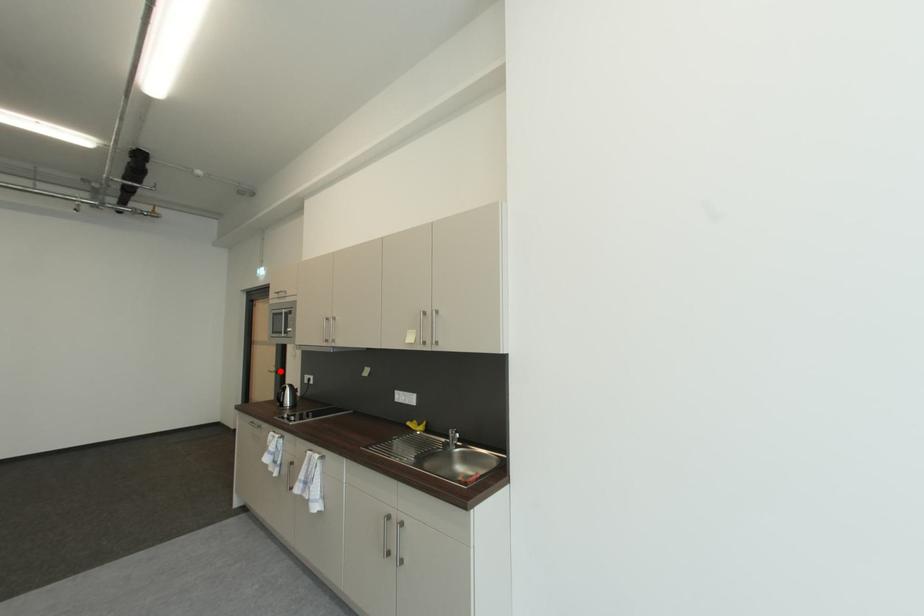
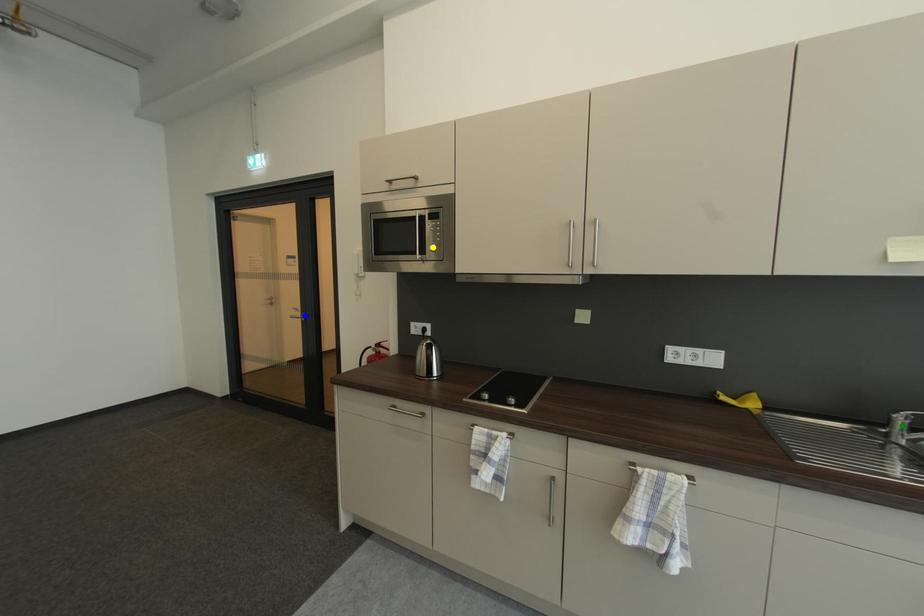
Question: I am providing you with two images of the same scene from different viewpoints. A red point is marked on the first image. You are given multiple points on the second image. Which point in image 2 is actually the same real-world point as the red point in image 1?

Choices:
 (A) green point
 (B) blue point
 (C) yellow point

Answer: (B)